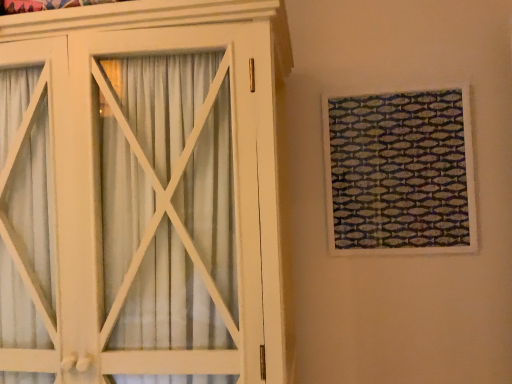
Measure the distance between white wood cupboard at left and camera.

white wood cupboard at left is 37.81 inches from camera.

This screenshot has height=384, width=512. What do you see at coordinates (141, 192) in the screenshot?
I see `white wood cupboard at left` at bounding box center [141, 192].

Measure the distance between point [117,70] and camera.

The distance of point [117,70] from camera is 1.06 meters.

You are a GUI agent. You are given a task and a screenshot of the screen. Output one action in this format:
    pyautogui.click(x=<x>, y=<y>)
    Task: Click on the white wood cupboard at left
    
    Given the screenshot: What is the action you would take?
    pyautogui.click(x=141, y=192)

What do you see at coordinates (400, 173) in the screenshot?
I see `textured fabric at upper right` at bounding box center [400, 173].

The image size is (512, 384). Find the location of `textured fabric at upper right`. textured fabric at upper right is located at coordinates (400, 173).

Locate an element on the screen. white wood cupboard at left is located at coordinates (141, 192).

Is white wood cupboard at left to the right of textured fabric at upper right from the viewer's perspective?

No.

Is the depth of white wood cupboard at left less than that of textured fabric at upper right?

Yes, white wood cupboard at left is closer to the viewer.

Does point (9, 56) come farther from viewer compared to point (337, 186)?

No, (9, 56) is closer to viewer.

From the image's perspective, which one is positioned higher, white wood cupboard at left or textured fabric at upper right?

From the image's view, textured fabric at upper right is above.

From a real-world perspective, is white wood cupboard at left located beneath textured fabric at upper right?

Indeed, from a real-world perspective, white wood cupboard at left is positioned beneath textured fabric at upper right.

Does white wood cupboard at left have a lesser width compared to textured fabric at upper right?

No, white wood cupboard at left is not thinner than textured fabric at upper right.

Considering the sizes of white wood cupboard at left and textured fabric at upper right in the image, is white wood cupboard at left taller or shorter than textured fabric at upper right?

In the image, white wood cupboard at left appears to be taller than textured fabric at upper right.

Considering the sizes of white wood cupboard at left and textured fabric at upper right in the image, is white wood cupboard at left bigger or smaller than textured fabric at upper right?

In the image, white wood cupboard at left appears to be larger than textured fabric at upper right.

Is textured fabric at upper right surrounded by white wood cupboard at left?

No.

Would you say white wood cupboard at left is a long distance from textured fabric at upper right?

That's not correct — white wood cupboard at left is a little close to textured fabric at upper right.

Could you tell me if white wood cupboard at left is facing textured fabric at upper right?

No, white wood cupboard at left is not turned towards textured fabric at upper right.

Measure the distance from white wood cupboard at left to textured fabric at upper right.

white wood cupboard at left and textured fabric at upper right are 29.19 inches apart from each other.

This screenshot has height=384, width=512. In the image, there is a textured fabric at upper right. What are the coordinates of `cupboard below it (from the image's perspective)` in the screenshot? It's located at (141, 192).

Which is more to the right, textured fabric at upper right or white wood cupboard at left?

From the viewer's perspective, textured fabric at upper right appears more on the right side.

From the picture: Is textured fabric at upper right positioned behind white wood cupboard at left?

Yes, it is.

Considering the positions of points (422, 213) and (250, 302), is point (422, 213) farther from camera compared to point (250, 302)?

Yes, it is behind point (250, 302).

From the image's perspective, is textured fabric at upper right above white wood cupboard at left?

Yes.

From a real-world perspective, is textured fabric at upper right located beneath white wood cupboard at left?

No, from a real-world perspective, textured fabric at upper right is not beneath white wood cupboard at left.

Considering the sizes of objects textured fabric at upper right and white wood cupboard at left in the image provided, who is thinner, textured fabric at upper right or white wood cupboard at left?

textured fabric at upper right.

Is textured fabric at upper right taller or shorter than white wood cupboard at left?

Clearly, textured fabric at upper right is shorter compared to white wood cupboard at left.

Who is smaller, textured fabric at upper right or white wood cupboard at left?

→ With smaller size is textured fabric at upper right.

Would you say textured fabric at upper right is outside white wood cupboard at left?

textured fabric at upper right lies outside white wood cupboard at left's area.

Is textured fabric at upper right far away from white wood cupboard at left?

No, there isn't a large distance between textured fabric at upper right and white wood cupboard at left.

Could you tell me if textured fabric at upper right is turned towards white wood cupboard at left?

No.

How far apart are textured fabric at upper right and white wood cupboard at left?

textured fabric at upper right and white wood cupboard at left are 74.14 centimeters apart from each other.

At what (x,y) coordinates should I click in order to perform the action: click on window on the right of the white wood cupboard at left. Please return your answer as a coordinate pair (x, y). The width and height of the screenshot is (512, 384). Looking at the image, I should click on (400, 173).

This screenshot has height=384, width=512. In order to click on window behind the white wood cupboard at left in this screenshot , I will do `click(400, 173)`.

You are a GUI agent. You are given a task and a screenshot of the screen. Output one action in this format:
    pyautogui.click(x=<x>, y=<y>)
    Task: Click on the window above the white wood cupboard at left (from a real-world perspective)
    This screenshot has width=512, height=384.
    Given the screenshot: What is the action you would take?
    pyautogui.click(x=400, y=173)